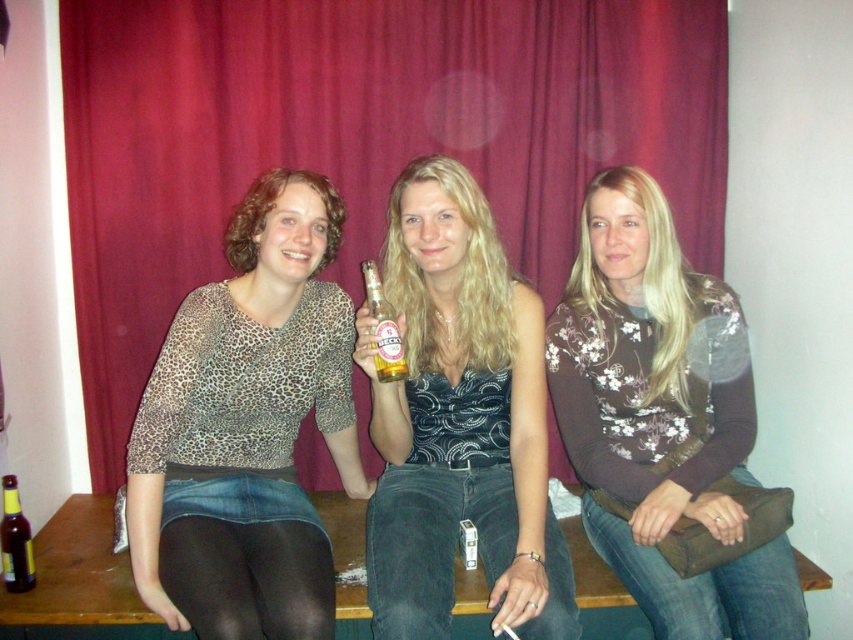
Between point (335, 28) and point (403, 312), which one is positioned behind?

Point (335, 28)

Between red velvet curtain at upper center and shiny silver necklace at center, which one has more height?

Standing taller between the two is red velvet curtain at upper center.

Describe the element at coordinates (360, 138) in the screenshot. I see `red velvet curtain at upper center` at that location.

You are a GUI agent. You are given a task and a screenshot of the screen. Output one action in this format:
    pyautogui.click(x=<x>, y=<y>)
    Task: Click on the red velvet curtain at upper center
    The image size is (853, 640).
    Given the screenshot: What is the action you would take?
    pyautogui.click(x=360, y=138)

Which is above, brown floral sweater at center or brown glass bottle at lower left?

brown floral sweater at center is higher up.

Is point (581, 378) closer to viewer compared to point (4, 584)?

No.

Does point (637, 404) come farther from viewer compared to point (27, 576)?

That is True.

Identify the location of brown floral sweater at center. The image size is (853, 640). (666, 426).

Does leopard print blouse at center have a greater width compared to shiny silver necklace at center?

Yes, leopard print blouse at center is wider than shiny silver necklace at center.

Is the position of leopard print blouse at center more distant than that of shiny silver necklace at center?

Yes, leopard print blouse at center is further from the viewer.

Between point (136, 561) and point (541, 413), which one is positioned behind?

The point (541, 413) is behind.

Find the location of a particular element. The width and height of the screenshot is (853, 640). leopard print blouse at center is located at coordinates (247, 428).